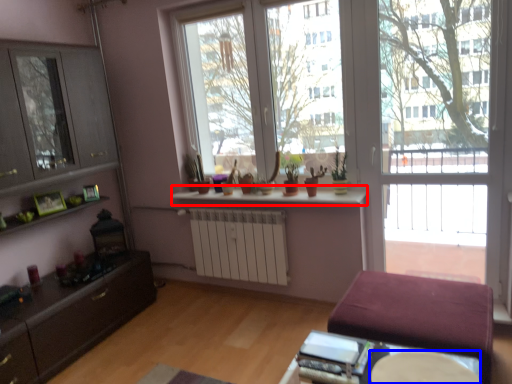
Question: Which object appears farthest to the camera in this image, window sill (highlighted by a red box) or round table (highlighted by a blue box)?

Choices:
 (A) window sill
 (B) round table

Answer: (A)